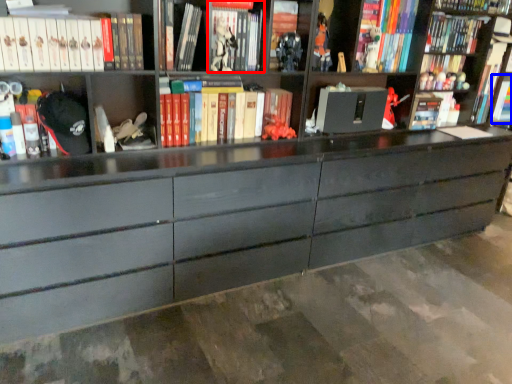
Question: Which point is further to the camera, book (highlighted by a red box) or book (highlighted by a blue box)?

Choices:
 (A) book
 (B) book

Answer: (B)